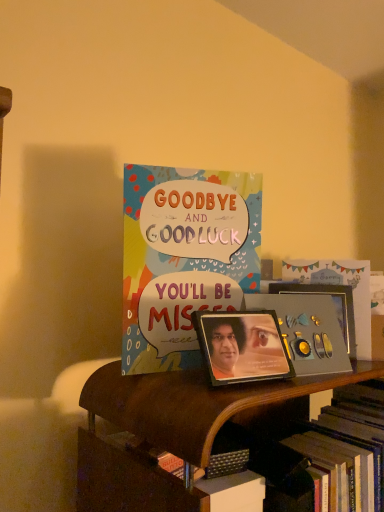
What do you see at coordinates (333, 302) in the screenshot?
I see `metallic gold picture frame at center, which ranks as the 1th picture frame in right-to-left order` at bounding box center [333, 302].

This screenshot has width=384, height=512. What do you see at coordinates (184, 258) in the screenshot?
I see `multicolored paper card at center` at bounding box center [184, 258].

Find the location of `multicolored paper card at center`. multicolored paper card at center is located at coordinates (184, 258).

Locate an element on the screen. wooden bookshelf at lower center is located at coordinates (193, 403).

Measure the distance between metallic photo frame at center, the first picture frame positioned from the front, and camera.

metallic photo frame at center, the first picture frame positioned from the front, is 21.91 inches away from camera.

This screenshot has width=384, height=512. In order to click on metallic gold picture frame at center, the second picture frame from the left in this screenshot , I will do `click(333, 302)`.

Does wooden bookshelf at lower center have a greater width compared to metallic photo frame at center, the first picture frame positioned from the left?

Indeed, wooden bookshelf at lower center has a greater width compared to metallic photo frame at center, the first picture frame positioned from the left.

Measure the distance from wooden bookshelf at lower center to metallic photo frame at center, the 2th picture frame in the right-to-left sequence.

wooden bookshelf at lower center is 10.01 centimeters away from metallic photo frame at center, the 2th picture frame in the right-to-left sequence.

Is metallic photo frame at center, the 2th picture frame in the right-to-left sequence, a part of wooden bookshelf at lower center?

No, metallic photo frame at center, the 2th picture frame in the right-to-left sequence, is not surrounded by wooden bookshelf at lower center.

Is wooden bookshelf at lower center taller or shorter than metallic photo frame at center, the 2th picture frame in the right-to-left sequence?

Considering their sizes, wooden bookshelf at lower center has more height than metallic photo frame at center, the 2th picture frame in the right-to-left sequence.

Is wooden bookshelf at lower center far from multicolored paper card at center?

They are positioned close to each other.

From the image's perspective, is wooden bookshelf at lower center positioned above or below multicolored paper card at center?

Clearly, from the image's perspective, wooden bookshelf at lower center is below multicolored paper card at center.

Is wooden bookshelf at lower center located outside multicolored paper card at center?

Yes, wooden bookshelf at lower center is located beyond the bounds of multicolored paper card at center.

From a real-world perspective, is wooden bookshelf at lower center over multicolored paper card at center?

Actually, wooden bookshelf at lower center is physically below multicolored paper card at center in the real world.

Is metallic photo frame at center, the first picture frame positioned from the left, at the back of multicolored paper card at center?

That's right, multicolored paper card at center is facing away from metallic photo frame at center, the first picture frame positioned from the left.

From a real-world perspective, between multicolored paper card at center and metallic photo frame at center, the first picture frame positioned from the front, who is vertically higher?

multicolored paper card at center, from a real-world perspective.

Does point (212, 210) appear closer or farther from the camera than point (267, 353)?

Clearly, point (212, 210) is more distant from the camera than point (267, 353).

From the image's perspective, which one is positioned lower, multicolored paper card at center or metallic photo frame at center, the 2th picture frame in the right-to-left sequence?

metallic photo frame at center, the 2th picture frame in the right-to-left sequence, from the image's perspective.

Based on the photo, is multicolored paper card at center beside metallic gold picture frame at center, the second picture frame from the left?

multicolored paper card at center is not next to metallic gold picture frame at center, the second picture frame from the left, and they're not touching.

Considering the positions of objects multicolored paper card at center and metallic gold picture frame at center, the second picture frame from the left, in the image provided, who is more to the right, multicolored paper card at center or metallic gold picture frame at center, the second picture frame from the left,?

Positioned to the right is metallic gold picture frame at center, the second picture frame from the left.

Can you tell me how much multicolored paper card at center and metallic gold picture frame at center, the 1th picture frame when ordered from back to front, differ in facing direction?

There is a 2.57-degree angle between the facing directions of multicolored paper card at center and metallic gold picture frame at center, the 1th picture frame when ordered from back to front.

Which is nearer, (284, 351) or (342, 310)?

Point (284, 351) is positioned closer to the camera compared to point (342, 310).

Which object is closer to the camera, metallic photo frame at center, the 2th picture frame in the right-to-left sequence, or metallic gold picture frame at center, the second picture frame from the left?

Positioned in front is metallic photo frame at center, the 2th picture frame in the right-to-left sequence.

Is metallic photo frame at center, arranged as the 2th picture frame when viewed from the back, to the left or to the right of metallic gold picture frame at center, the 1th picture frame when ordered from back to front, in the image?

metallic photo frame at center, arranged as the 2th picture frame when viewed from the back, is positioned on metallic gold picture frame at center, the 1th picture frame when ordered from back to front,'s left side.

Is metallic photo frame at center, the 2th picture frame in the right-to-left sequence, next to metallic gold picture frame at center, which ranks as the 1th picture frame in right-to-left order?

No, metallic photo frame at center, the 2th picture frame in the right-to-left sequence, is not with metallic gold picture frame at center, which ranks as the 1th picture frame in right-to-left order.

Is metallic gold picture frame at center, the 2th picture frame viewed from the front, inside the boundaries of multicolored paper card at center, or outside?

metallic gold picture frame at center, the 2th picture frame viewed from the front, lies outside multicolored paper card at center.

Is metallic gold picture frame at center, the 1th picture frame when ordered from back to front, further to the viewer compared to multicolored paper card at center?

Yes.

Which is more to the left, metallic gold picture frame at center, the second picture frame from the left, or multicolored paper card at center?

Positioned to the left is multicolored paper card at center.

Is metallic gold picture frame at center, which ranks as the 1th picture frame in right-to-left order, facing towards multicolored paper card at center?

No.

Is metallic photo frame at center, the first picture frame positioned from the left, touching multicolored paper card at center?

No, metallic photo frame at center, the first picture frame positioned from the left, is not next to multicolored paper card at center.

Which object is positioned more to the right, metallic photo frame at center, arranged as the 2th picture frame when viewed from the back, or multicolored paper card at center?

metallic photo frame at center, arranged as the 2th picture frame when viewed from the back, is more to the right.

Does metallic photo frame at center, the 2th picture frame in the right-to-left sequence, turn towards multicolored paper card at center?

No, metallic photo frame at center, the 2th picture frame in the right-to-left sequence, is not aimed at multicolored paper card at center.

Does point (287, 359) come farther from viewer compared to point (191, 301)?

No, (287, 359) is closer to viewer.

The width and height of the screenshot is (384, 512). There is a wooden bookshelf at lower center. What are the coordinates of `the 1st picture frame above it (from a real-world perspective)` in the screenshot? It's located at click(x=242, y=346).

In the image, there is a multicolored paper card at center. Where is `shelf below it (from the image's perspective)`? shelf below it (from the image's perspective) is located at coordinates (193, 403).

Looking at the image, which one is located further to wooden bookshelf at lower center, metallic gold picture frame at center, which ranks as the 1th picture frame in right-to-left order, or multicolored paper card at center?

metallic gold picture frame at center, which ranks as the 1th picture frame in right-to-left order, lies further to wooden bookshelf at lower center than the other object.

Based on their spatial positions, is metallic gold picture frame at center, the 1th picture frame when ordered from back to front, or wooden bookshelf at lower center closer to metallic photo frame at center, arranged as the 2th picture frame when viewed from the back?

wooden bookshelf at lower center.

From the image, which object appears to be nearer to metallic gold picture frame at center, the second picture frame from the left, wooden bookshelf at lower center or metallic photo frame at center, the 2th picture frame in the right-to-left sequence?

Among the two, metallic photo frame at center, the 2th picture frame in the right-to-left sequence, is located nearer to metallic gold picture frame at center, the second picture frame from the left.

In the scene shown: From the image, which object appears to be farther from wooden bookshelf at lower center, metallic gold picture frame at center, the 1th picture frame when ordered from back to front, or metallic photo frame at center, the 2th picture frame in the right-to-left sequence?

metallic gold picture frame at center, the 1th picture frame when ordered from back to front, is positioned further to the anchor wooden bookshelf at lower center.

When comparing their distances from multicolored paper card at center, does wooden bookshelf at lower center or metallic gold picture frame at center, the second picture frame from the left, seem closer?

wooden bookshelf at lower center is positioned closer to the anchor multicolored paper card at center.

Looking at the image, which one is located closer to multicolored paper card at center, metallic gold picture frame at center, the 2th picture frame viewed from the front, or wooden bookshelf at lower center?

wooden bookshelf at lower center.

Considering their positions, is multicolored paper card at center positioned further to wooden bookshelf at lower center than metallic gold picture frame at center, the 1th picture frame when ordered from back to front?

Among the two, metallic gold picture frame at center, the 1th picture frame when ordered from back to front, is located further to wooden bookshelf at lower center.

From the image, which object appears to be farther from wooden bookshelf at lower center, metallic photo frame at center, arranged as the 2th picture frame when viewed from the back, or metallic gold picture frame at center, the 1th picture frame when ordered from back to front?

metallic gold picture frame at center, the 1th picture frame when ordered from back to front, is further to wooden bookshelf at lower center.

At what (x,y) coordinates should I click in order to perform the action: click on picture frame between metallic gold picture frame at center, the 2th picture frame viewed from the front, and wooden bookshelf at lower center vertically. Please return your answer as a coordinate pair (x, y). This screenshot has width=384, height=512. Looking at the image, I should click on (242, 346).

In order to click on picture frame between multicolored paper card at center and metallic gold picture frame at center, which ranks as the 1th picture frame in right-to-left order, in the horizontal direction in this screenshot , I will do `click(242, 346)`.